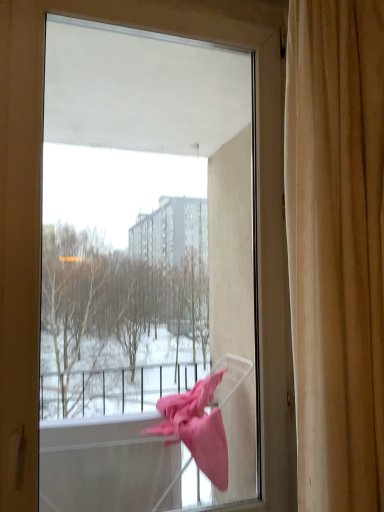
Question: From a real-world perspective, relative to transparent plastic basket at lower right, is beige fabric curtain at right vertically above or below?

Choices:
 (A) below
 (B) above

Answer: (B)

Question: In the image, is beige fabric curtain at right positioned in front of or behind transparent plastic basket at lower right?

Choices:
 (A) front
 (B) behind

Answer: (A)

Question: Is point (321, 24) closer or farther from the camera than point (31, 217)?

Choices:
 (A) closer
 (B) farther

Answer: (A)

Question: Is transparent plastic basket at lower right to the left or to the right of beige fabric curtain at right in the image?

Choices:
 (A) left
 (B) right

Answer: (A)

Question: In terms of width, does transparent plastic basket at lower right look wider or thinner when compared to beige fabric curtain at right?

Choices:
 (A) wide
 (B) thin

Answer: (B)

Question: In terms of size, does transparent plastic basket at lower right appear bigger or smaller than beige fabric curtain at right?

Choices:
 (A) small
 (B) big

Answer: (B)

Question: Considering the positions of transparent plastic basket at lower right and beige fabric curtain at right in the image, is transparent plastic basket at lower right taller or shorter than beige fabric curtain at right?

Choices:
 (A) tall
 (B) short

Answer: (A)